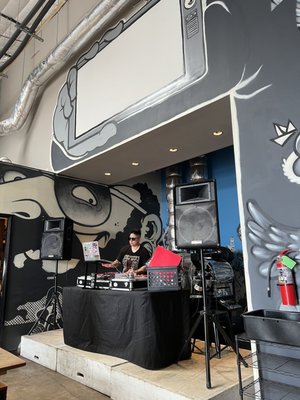
Where is `blanket`? The width and height of the screenshot is (300, 400). blanket is located at coordinates (152, 328).